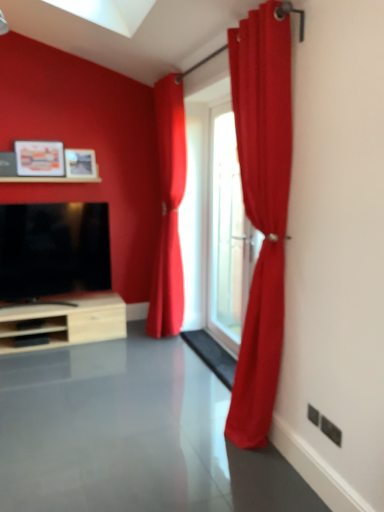
Locate an element on the screen. free space in front of satin red curtain at right, which is counted as the 2th curtain, starting from the back is located at coordinates (244, 472).